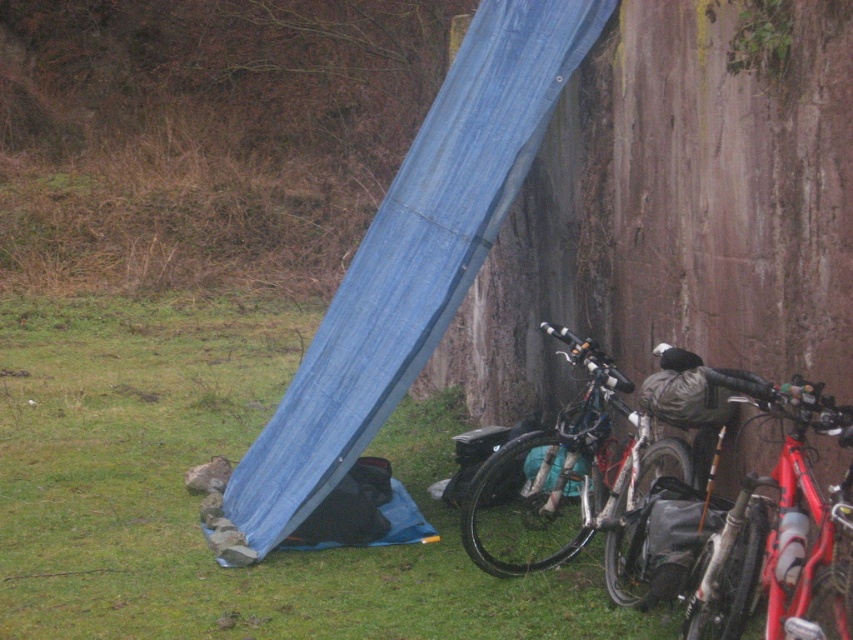
Is blue tarp at lower left to the right of silver metallic bicycle at center from the viewer's perspective?

No, blue tarp at lower left is not to the right of silver metallic bicycle at center.

Is blue tarp at lower left shorter than silver metallic bicycle at center?

No, blue tarp at lower left is not shorter than silver metallic bicycle at center.

Is point (280, 532) more distant than point (469, 506)?

Yes, point (280, 532) is behind point (469, 506).

The image size is (853, 640). Find the location of `blue tarp at lower left`. blue tarp at lower left is located at coordinates tap(412, 260).

Between red matte bicycle at right and silver metallic bicycle at center, which one appears on the right side from the viewer's perspective?

From the viewer's perspective, red matte bicycle at right appears more on the right side.

Measure the distance between red matte bicycle at right and silver metallic bicycle at center.

red matte bicycle at right and silver metallic bicycle at center are 5.18 feet apart from each other.

Does point (726, 634) come in front of point (606, 524)?

Yes, point (726, 634) is in front of point (606, 524).

Locate an element on the screen. The width and height of the screenshot is (853, 640). red matte bicycle at right is located at coordinates (776, 528).

From the picture: Is blue tarp at lower left closer to camera compared to red matte bicycle at right?

No.

Is blue tarp at lower left to the right of red matte bicycle at right from the viewer's perspective?

Incorrect, blue tarp at lower left is not on the right side of red matte bicycle at right.

This screenshot has width=853, height=640. I want to click on blue tarp at lower left, so click(412, 260).